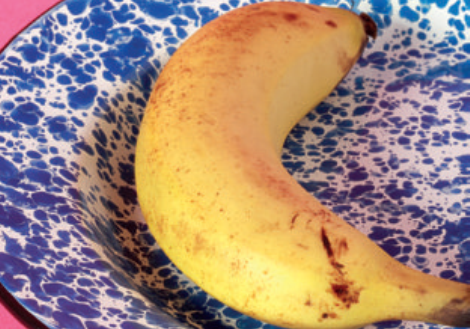
Image resolution: width=470 pixels, height=329 pixels. I want to click on table, so click(10, 322).